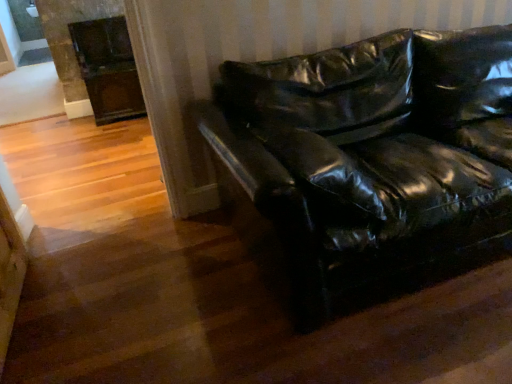
Question: From a real-world perspective, is dark brown wood fireplace at upper left under black leather couch at center?

Choices:
 (A) no
 (B) yes

Answer: (B)

Question: From a real-world perspective, is dark brown wood fireplace at upper left physically above black leather couch at center?

Choices:
 (A) yes
 (B) no

Answer: (B)

Question: Considering the relative sizes of dark brown wood fireplace at upper left and black leather couch at center in the image provided, is dark brown wood fireplace at upper left bigger than black leather couch at center?

Choices:
 (A) no
 (B) yes

Answer: (A)

Question: Is dark brown wood fireplace at upper left to the right of black leather couch at center from the viewer's perspective?

Choices:
 (A) yes
 (B) no

Answer: (B)

Question: Is dark brown wood fireplace at upper left at the left side of black leather couch at center?

Choices:
 (A) yes
 (B) no

Answer: (A)

Question: Is dark brown wood fireplace at upper left turned away from black leather couch at center?

Choices:
 (A) yes
 (B) no

Answer: (B)

Question: From a real-world perspective, does black leather couch at center stand above dark brown wood fireplace at upper left?

Choices:
 (A) no
 (B) yes

Answer: (B)

Question: Does black leather couch at center have a lesser width compared to dark brown wood fireplace at upper left?

Choices:
 (A) yes
 (B) no

Answer: (B)

Question: Can we say black leather couch at center lies outside dark brown wood fireplace at upper left?

Choices:
 (A) yes
 (B) no

Answer: (A)

Question: Is black leather couch at center positioned with its back to dark brown wood fireplace at upper left?

Choices:
 (A) no
 (B) yes

Answer: (B)

Question: Does black leather couch at center have a larger size compared to dark brown wood fireplace at upper left?

Choices:
 (A) no
 (B) yes

Answer: (B)

Question: Can you see black leather couch at center touching dark brown wood fireplace at upper left?

Choices:
 (A) yes
 (B) no

Answer: (B)

Question: Is black leather couch at center situated inside dark brown wood fireplace at upper left or outside?

Choices:
 (A) outside
 (B) inside

Answer: (A)